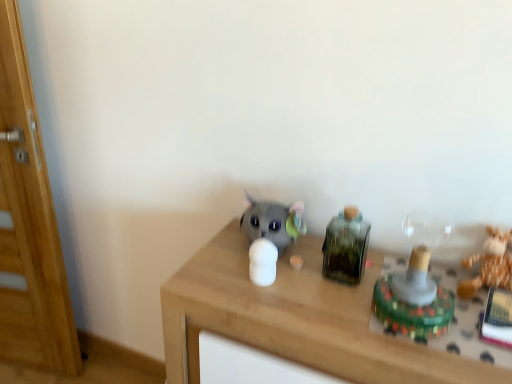
The height and width of the screenshot is (384, 512). Find the location of `vacant space to the left of green glass bottle at center-right, arranged as the third toy when viewed from the right`. vacant space to the left of green glass bottle at center-right, arranged as the third toy when viewed from the right is located at coordinates (284, 283).